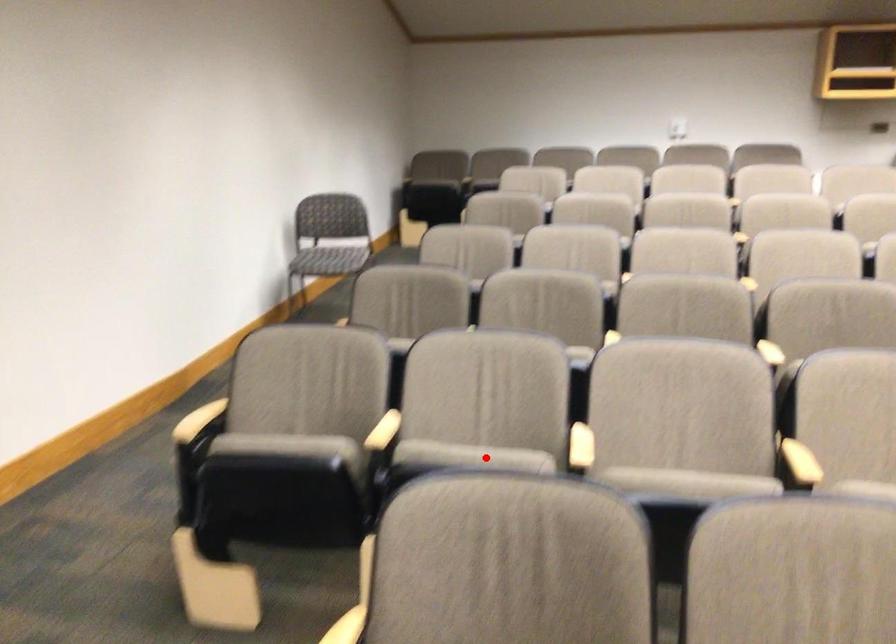
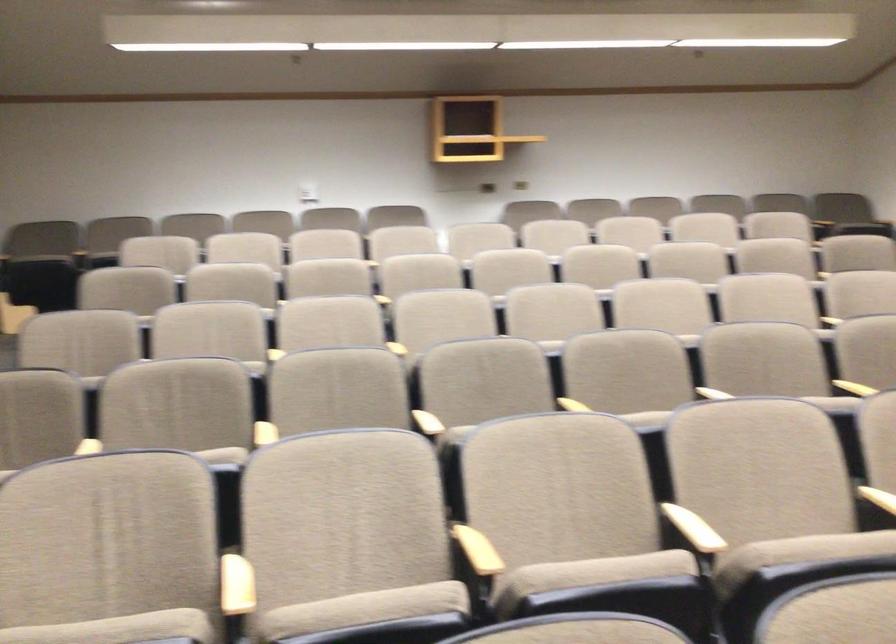
Question: I am providing you with two images of the same scene from different viewpoints. A red point is shown in image1. For the corresponding object point in image2, is it positioned nearer or farther from the camera?

Choices:
 (A) Nearer
 (B) Farther

Answer: (A)